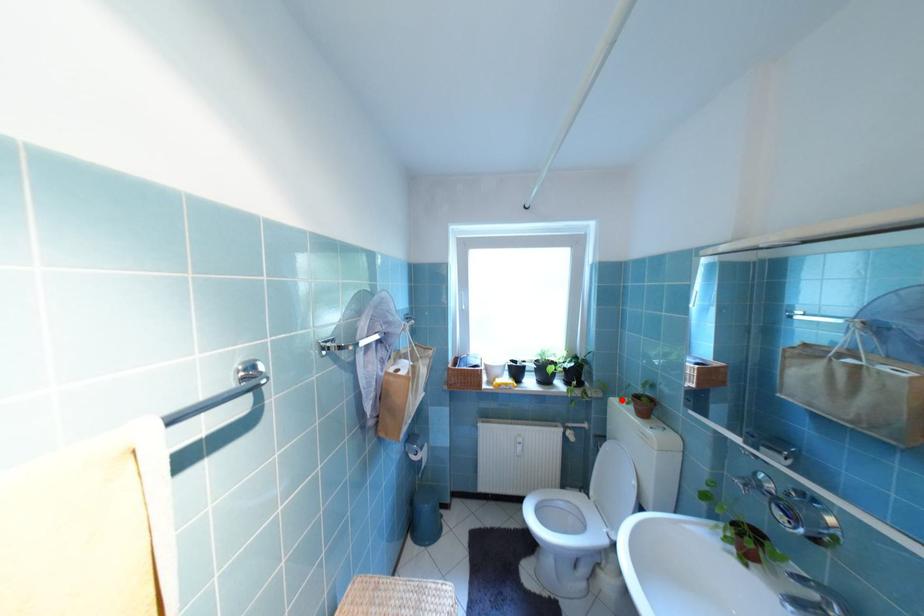
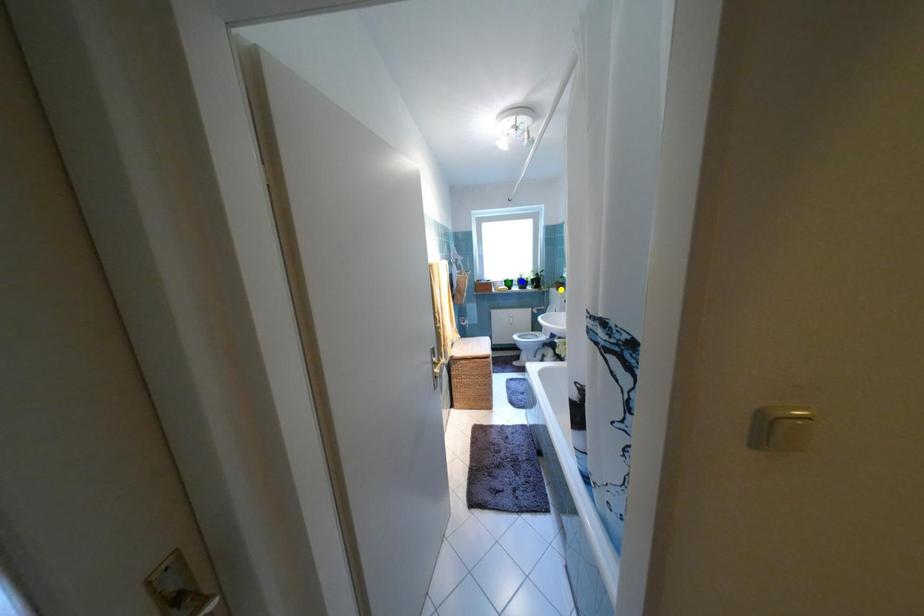
Question: I am providing you with two images of the same scene from different viewpoints. A red point is marked on the first image. You are given multiple points on the second image. In image 2, which mark is for the same physical point as the one in image 1?

Choices:
 (A) blue point
 (B) yellow point
 (C) green point

Answer: (B)